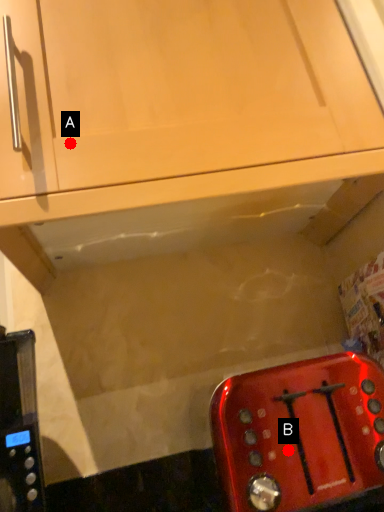
Question: Two points are circled on the image, labeled by A and B beside each circle. Which point is closer to the camera taking this photo?

Choices:
 (A) A is closer
 (B) B is closer

Answer: (A)